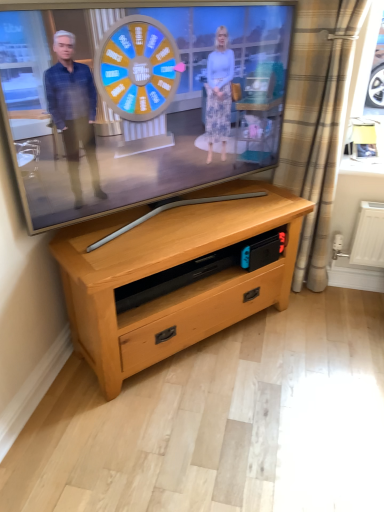
Where is `vacant area that is in front of beige plaid curtain at right`? This screenshot has width=384, height=512. vacant area that is in front of beige plaid curtain at right is located at coordinates (329, 316).